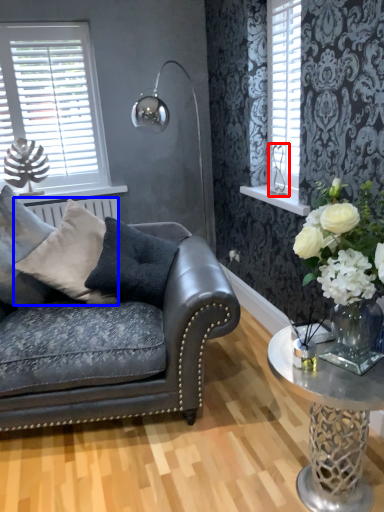
Question: Which of the following is the closest to the observer, silver (highlighted by a red box) or pillow (highlighted by a blue box)?

Choices:
 (A) silver
 (B) pillow

Answer: (B)